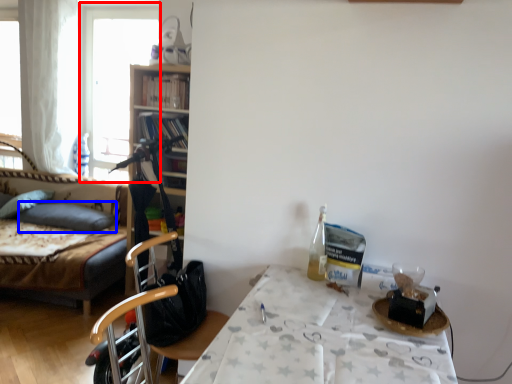
Question: Among these objects, which one is farthest to the camera, window (highlighted by a red box) or pillow (highlighted by a blue box)?

Choices:
 (A) window
 (B) pillow

Answer: (A)